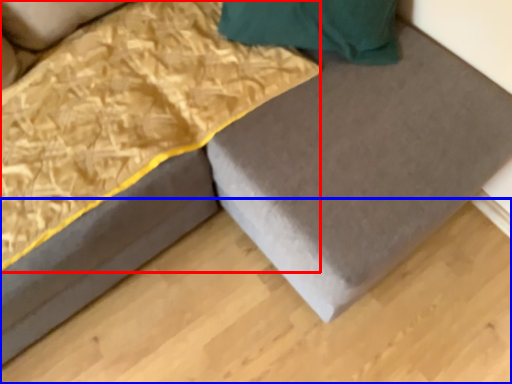
Question: Which object is closer to the camera taking this photo, blanket (highlighted by a red box) or plywood (highlighted by a blue box)?

Choices:
 (A) blanket
 (B) plywood

Answer: (A)